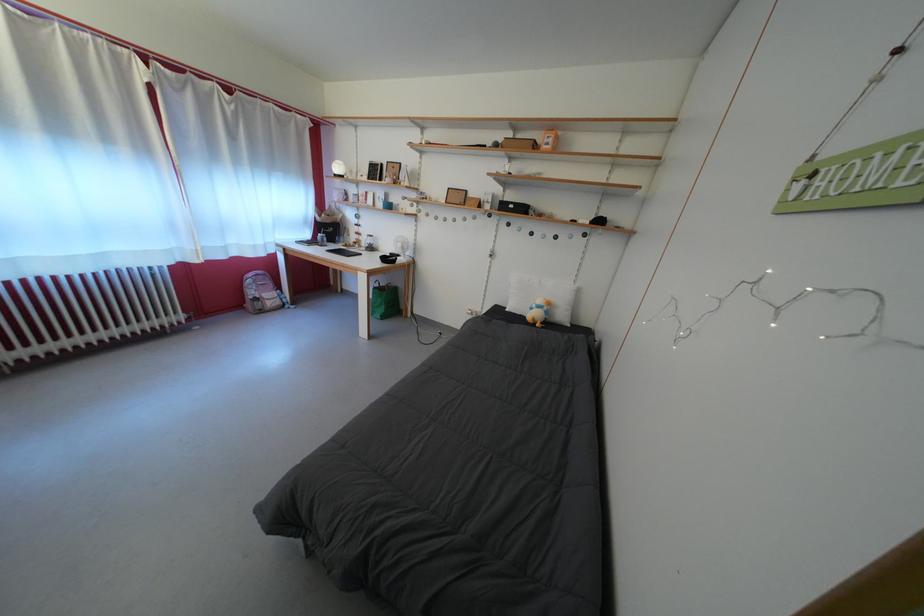
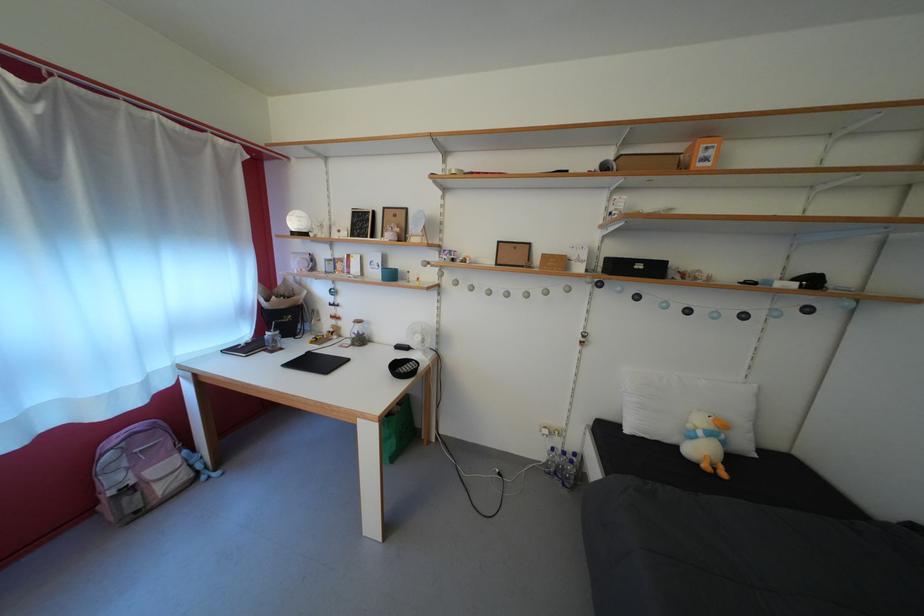
Find the pixel in the second image that matches (373,246) in the first image.

(358, 334)